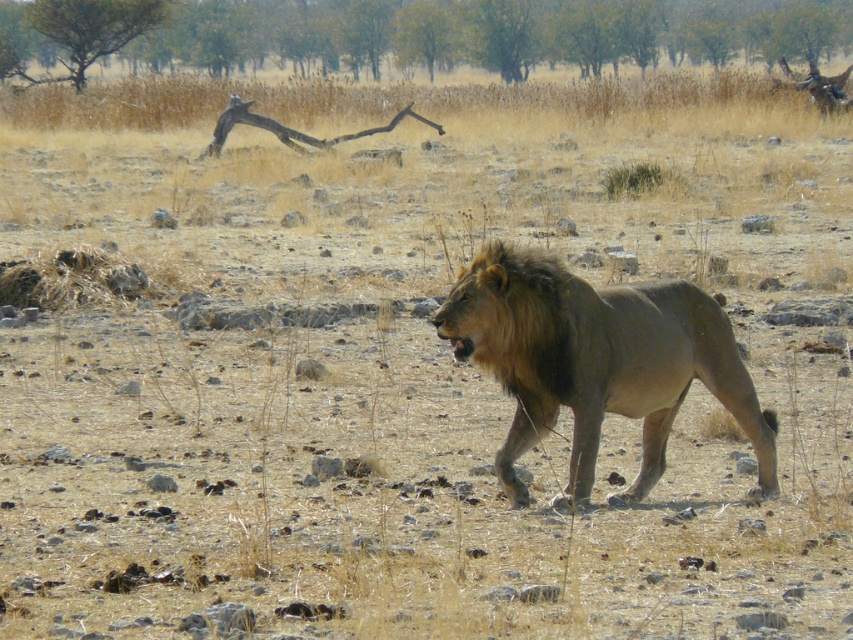
Can you confirm if green leafy tree at upper center is wider than green leafy tree at upper left?

Indeed, green leafy tree at upper center has a greater width compared to green leafy tree at upper left.

Is green leafy tree at upper center closer to the viewer compared to green leafy tree at upper left?

Yes, green leafy tree at upper center is in front of green leafy tree at upper left.

Image resolution: width=853 pixels, height=640 pixels. Identify the location of green leafy tree at upper center. (428, 33).

Is golden fur lion at center positioned behind green leafy tree at upper left?

No, it is in front of green leafy tree at upper left.

Does golden fur lion at center appear under green leafy tree at upper left?

Indeed, golden fur lion at center is positioned under green leafy tree at upper left.

This screenshot has width=853, height=640. What are the coordinates of `golden fur lion at center` in the screenshot? It's located at (596, 362).

Who is shorter, green leafy tree at upper center or golden fur lion at center?

Standing shorter between the two is golden fur lion at center.

Measure the distance between point (16, 44) and camera.

The distance of point (16, 44) from camera is 53.73 meters.

Find the location of `green leafy tree at upper center`. green leafy tree at upper center is located at coordinates (428, 33).